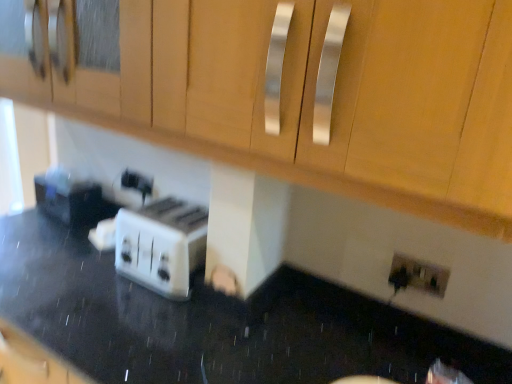
The image size is (512, 384). Describe the element at coordinates (215, 323) in the screenshot. I see `white glossy toaster at lower left` at that location.

Describe the element at coordinates (161, 245) in the screenshot. This screenshot has width=512, height=384. I see `white plastic toaster at center` at that location.

What do you see at coordinates (417, 275) in the screenshot? I see `white plastic electric outlet at lower right` at bounding box center [417, 275].

Locate an element on the screen. Image resolution: width=512 pixels, height=384 pixels. matte wood cabinet at upper center is located at coordinates (293, 90).

Considering the points (450, 333) and (186, 270), which point is behind, point (450, 333) or point (186, 270)?

The point (186, 270) is farther.

Which is correct: white glossy toaster at lower left is inside white plastic toaster at center, or outside of it?

white glossy toaster at lower left is located beyond the bounds of white plastic toaster at center.

Is white glossy toaster at lower left facing towards white plastic toaster at center?

No, white glossy toaster at lower left is not facing towards white plastic toaster at center.

Is white glossy toaster at lower left in front of or behind white plastic toaster at center in the image?

white glossy toaster at lower left is in front of white plastic toaster at center.

Can you confirm if matte wood cabinet at upper center is positioned to the left of white plastic toaster at center?

No.

From the image's perspective, is matte wood cabinet at upper center below white plastic toaster at center?

Actually, matte wood cabinet at upper center appears above white plastic toaster at center in the image.

Which point is more forward, (488,122) or (186,235)?

The point (488,122) is closer to the camera.

Is matte wood cabinet at upper center positioned with its back to white plastic toaster at center?

matte wood cabinet at upper center does not have its back to white plastic toaster at center.

Looking at this image, does white plastic electric outlet at lower right have a lesser width compared to white plastic toaster at center?

Indeed, white plastic electric outlet at lower right has a lesser width compared to white plastic toaster at center.

Is white plastic electric outlet at lower right oriented away from white plastic toaster at center?

No, white plastic electric outlet at lower right is not facing the opposite direction of white plastic toaster at center.

From the image's perspective, is white plastic electric outlet at lower right positioned above or below white plastic toaster at center?

white plastic electric outlet at lower right is below white plastic toaster at center.

Could you tell me if white plastic toaster at center is facing white plastic electric outlet at lower right?

No, white plastic toaster at center is not aimed at white plastic electric outlet at lower right.

This screenshot has width=512, height=384. In order to click on electric outlet in front of the white plastic toaster at center in this screenshot , I will do `click(417, 275)`.

How distant is white plastic toaster at center from white plastic electric outlet at lower right?

white plastic toaster at center and white plastic electric outlet at lower right are 1.22 meters apart from each other.

Can you confirm if white plastic toaster at center is positioned to the right of white plastic electric outlet at lower right?

In fact, white plastic toaster at center is to the left of white plastic electric outlet at lower right.

Is white plastic toaster at center spatially inside white plastic toaster at center, or outside of it?

white plastic toaster at center is outside white plastic toaster at center.

Considering the positions of objects white plastic toaster at center and white plastic toaster at center in the image provided, who is more to the right, white plastic toaster at center or white plastic toaster at center?

white plastic toaster at center.

From a real-world perspective, is white plastic toaster at center physically above white plastic toaster at center?

No, from a real-world perspective, white plastic toaster at center is not above white plastic toaster at center.

Could you tell me if white glossy toaster at lower left is turned towards white plastic electric outlet at lower right?

No, white glossy toaster at lower left is not oriented towards white plastic electric outlet at lower right.

Based on the photo, does white glossy toaster at lower left appear on the right side of white plastic electric outlet at lower right?

No.

Measure the distance from white glossy toaster at lower left to white plastic electric outlet at lower right.

white glossy toaster at lower left and white plastic electric outlet at lower right are 48.29 centimeters apart from each other.

Based on the photo, is white glossy toaster at lower left behind white plastic electric outlet at lower right?

No.

How many degrees apart are the facing directions of white plastic electric outlet at lower right and white plastic toaster at center?

The angle between the facing direction of white plastic electric outlet at lower right and the facing direction of white plastic toaster at center is 6.77 degrees.

Consider the image. Considering the sizes of white plastic electric outlet at lower right and white plastic toaster at center in the image, is white plastic electric outlet at lower right bigger or smaller than white plastic toaster at center?

In the image, white plastic electric outlet at lower right appears to be smaller than white plastic toaster at center.

From the picture: From the image's perspective, is white plastic electric outlet at lower right above white plastic toaster at center?

No, from the image's perspective, white plastic electric outlet at lower right is not above white plastic toaster at center.

Can you confirm if white plastic electric outlet at lower right is wider than white plastic toaster at center?

No.

Locate an element on the screen. The image size is (512, 384). countertop on the left of white plastic toaster at center is located at coordinates (215, 323).

In the image, there is a white plastic toaster at center. Identify the location of cabinetry above it (from the image's perspective). The image size is (512, 384). (293, 90).

From the image, which object appears to be farther from white plastic toaster at center, matte wood cabinet at upper center or white plastic toaster at center?

Based on the image, white plastic toaster at center appears to be further to white plastic toaster at center.

From the picture: Estimate the real-world distances between objects in this image. Which object is further from white plastic toaster at center, white plastic toaster at center or white glossy toaster at lower left?

Among the two, white plastic toaster at center is located further to white plastic toaster at center.

From the image, which object appears to be farther from white plastic electric outlet at lower right, matte wood cabinet at upper center or white plastic toaster at center?

Based on the image, matte wood cabinet at upper center appears to be further to white plastic electric outlet at lower right.

Looking at the image, which one is located closer to white plastic toaster at center, white glossy toaster at lower left or white plastic toaster at center?

white glossy toaster at lower left is positioned closer to the anchor white plastic toaster at center.

From the image, which object appears to be farther from matte wood cabinet at upper center, white plastic electric outlet at lower right or white plastic toaster at center?

white plastic electric outlet at lower right lies further to matte wood cabinet at upper center than the other object.

Based on the photo, when comparing their distances from white glossy toaster at lower left, does white plastic electric outlet at lower right or white plastic toaster at center seem further?

The object further to white glossy toaster at lower left is white plastic toaster at center.

Looking at this image, from the image, which object appears to be nearer to white glossy toaster at lower left, matte wood cabinet at upper center or white plastic electric outlet at lower right?

white plastic electric outlet at lower right is positioned closer to the anchor white glossy toaster at lower left.

From the image, which object appears to be farther from matte wood cabinet at upper center, white glossy toaster at lower left or white plastic toaster at center?

Among the two, white plastic toaster at center is located further to matte wood cabinet at upper center.

The width and height of the screenshot is (512, 384). What are the coordinates of `toaster located between white glossy toaster at lower left and white plastic toaster at center in the depth direction` in the screenshot? It's located at (161, 245).

Locate an element on the screen. This screenshot has height=384, width=512. countertop located between white plastic toaster at center and white plastic electric outlet at lower right in the left-right direction is located at coordinates (215, 323).

Image resolution: width=512 pixels, height=384 pixels. Identify the location of countertop positioned between matte wood cabinet at upper center and white plastic toaster at center from near to far. (215, 323).

This screenshot has width=512, height=384. Find the location of `toaster between matte wood cabinet at upper center and white glossy toaster at lower left in the up-down direction`. toaster between matte wood cabinet at upper center and white glossy toaster at lower left in the up-down direction is located at coordinates (161, 245).